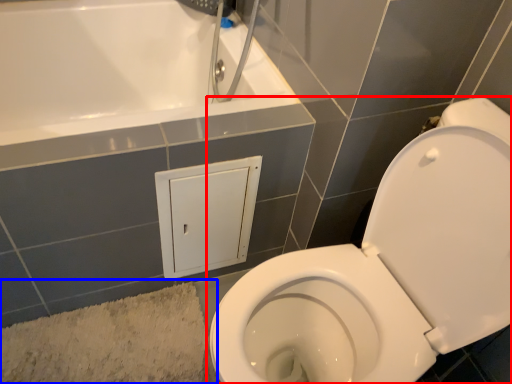
Question: Among these objects, which one is nearest to the camera, toilet (highlighted by a red box) or bath mat (highlighted by a blue box)?

Choices:
 (A) toilet
 (B) bath mat

Answer: (A)